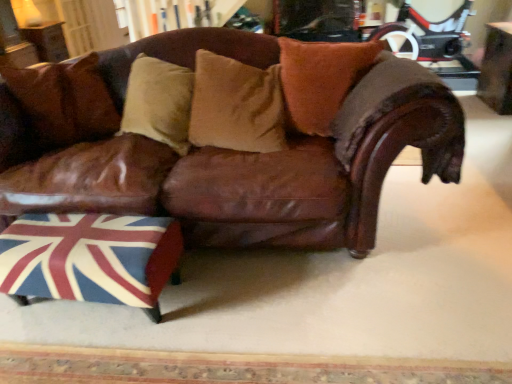
Find the location of a particular element. The image size is (512, 384). vacant area that lies to the right of union jack fabric ottoman at lower left is located at coordinates (218, 294).